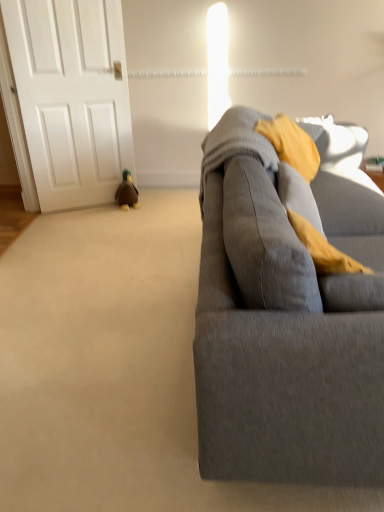
I want to click on vacant area that is situated to the right of brown plush duck at lower left, so click(x=150, y=205).